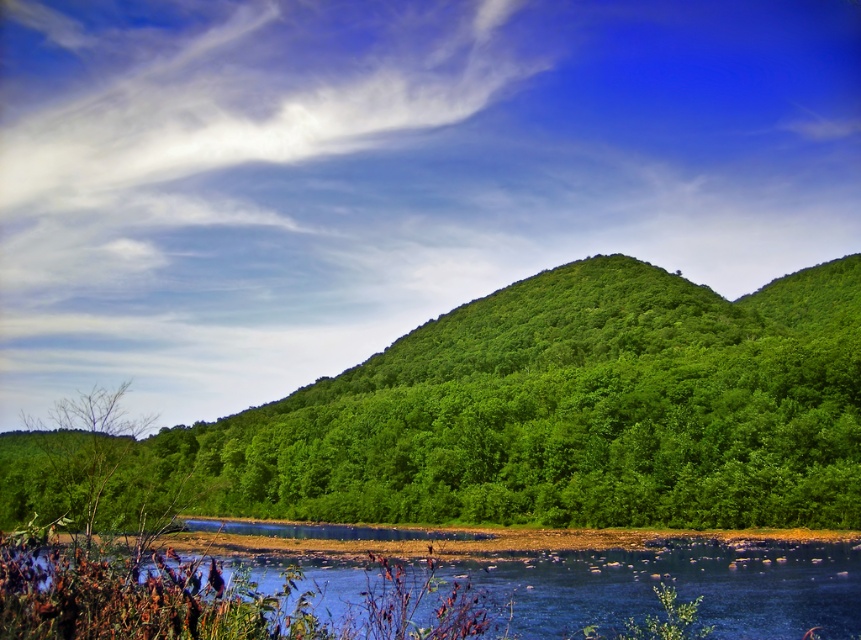
You are standing at the point labeled point (736, 605) and want to walk towards the point labeled point (100, 467). Given that you can only move in a straight line, will you have to go uphill or downhill?

Since point (736, 605) is closer to the viewer than point (100, 467), you will have to go uphill to reach it.

From the picture: You are standing at the edge of the blue water at lower center and want to reach the green leafy tree at center. Which direction should you move to get closer to the tree?

To reach the green leafy tree at center from the blue water at lower center, you should move upward since the tree is located above the water.

You are standing in the scene and want to walk from the green leafy tree at lower left to the blue water at lower center. Which direction should you head?

You should head to the right because the blue water at lower center is located to the right of the green leafy tree at lower left.